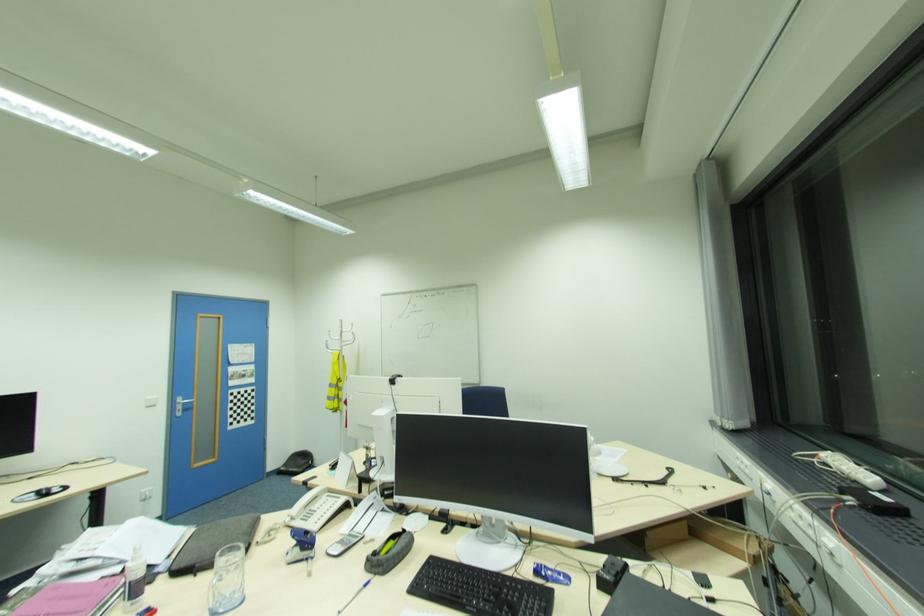
Describe the element at coordinates (213, 543) in the screenshot. The height and width of the screenshot is (616, 924). I see `a black pencil case` at that location.